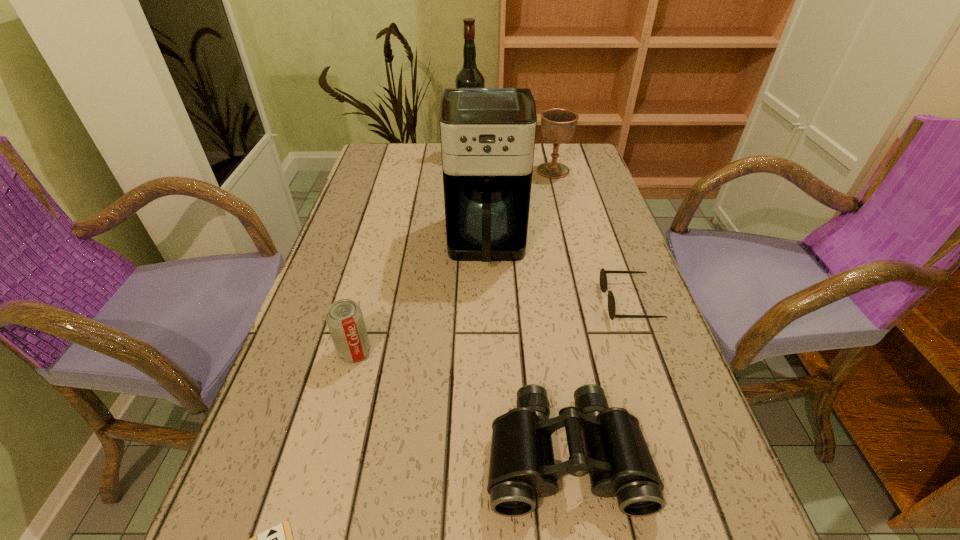
Locate an element on the screen. The image size is (960, 540). free spot that satisfies the following two spatial constraints: 1. on the back side of the fourth tallest object; 2. on the right side of the chalice is located at coordinates [x=402, y=171].

This screenshot has height=540, width=960. Find the location of `vacant space that satisfies the following two spatial constraints: 1. on the front and back of the farthest object; 2. on the right side of the chalice`. vacant space that satisfies the following two spatial constraints: 1. on the front and back of the farthest object; 2. on the right side of the chalice is located at coordinates (470, 171).

Find the location of a particular element. free space that satisfies the following two spatial constraints: 1. on the front-facing side of the sixth tallest object; 2. on the front-facing side of the binoculars is located at coordinates (683, 455).